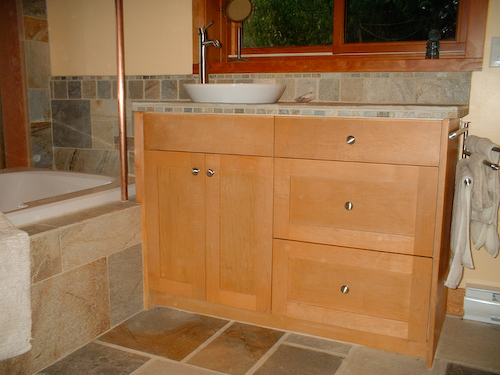
What are the coordinates of `towel rack` in the screenshot? It's located at (465, 149).